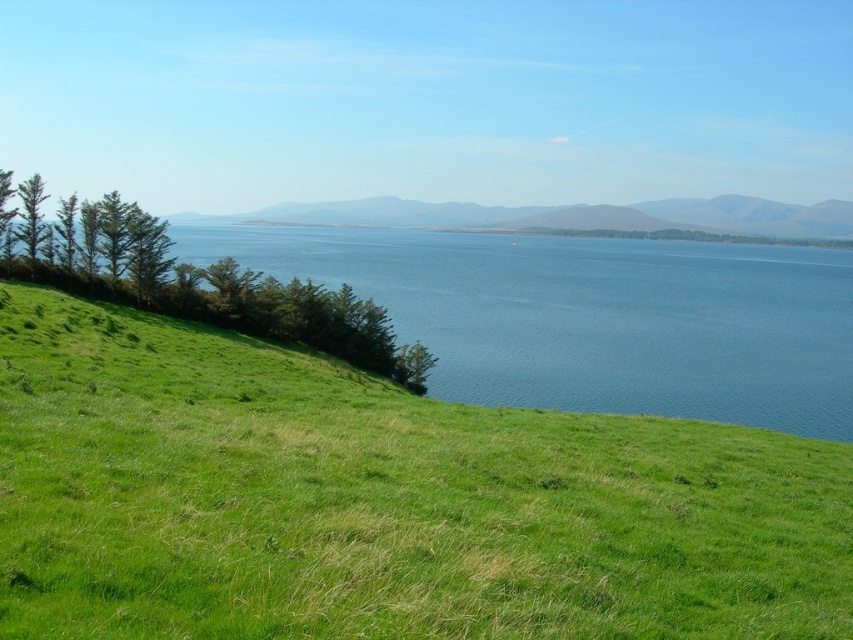
Is green grassy hillside at lower left positioned before blue water at left?

Yes, it is in front of blue water at left.

Can you confirm if green grassy hillside at lower left is taller than blue water at left?

No, green grassy hillside at lower left is not taller than blue water at left.

Describe the element at coordinates (379, 500) in the screenshot. I see `green grassy hillside at lower left` at that location.

At what (x,y) coordinates should I click in order to perform the action: click on green grassy hillside at lower left. Please return your answer as a coordinate pair (x, y). The height and width of the screenshot is (640, 853). Looking at the image, I should click on [x=379, y=500].